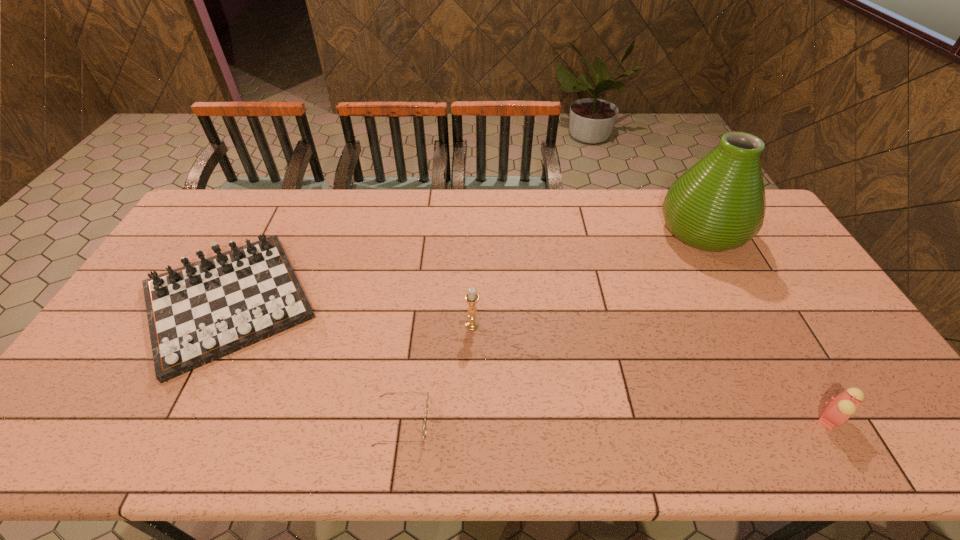
Where is `free space between the chessboard and the fourth shortest object`? This screenshot has height=540, width=960. free space between the chessboard and the fourth shortest object is located at coordinates (350, 313).

You are a GUI agent. You are given a task and a screenshot of the screen. Output one action in this format:
    pyautogui.click(x=<x>, y=<y>)
    Task: Click on the vacant space that is in between the shortest object and the alarm clock
    The width and height of the screenshot is (960, 540).
    Given the screenshot: What is the action you would take?
    pyautogui.click(x=616, y=421)

At what (x,y) coordinates should I click in order to perform the action: click on object that ranks as the second closest to the second tallest object. Please return your answer as a coordinate pair (x, y). The width and height of the screenshot is (960, 540). Looking at the image, I should click on (201, 312).

Where is `object that can be found as the third closest to the shortest object`? This screenshot has width=960, height=540. object that can be found as the third closest to the shortest object is located at coordinates (718, 204).

This screenshot has height=540, width=960. I want to click on free space that satisfies the following two spatial constraints: 1. on the back side of the leftmost object; 2. on the left side of the vase, so click(265, 231).

Locate an element on the screen. free location that satisfies the following two spatial constraints: 1. on the front side of the third object from right to left; 2. on the front-facing side of the shortest object is located at coordinates (471, 423).

The image size is (960, 540). What are the coordinates of `vacant position in the image that satisfies the following two spatial constraints: 1. on the face of the alarm clock; 2. on the front-facing side of the sunglasses` in the screenshot? It's located at (833, 423).